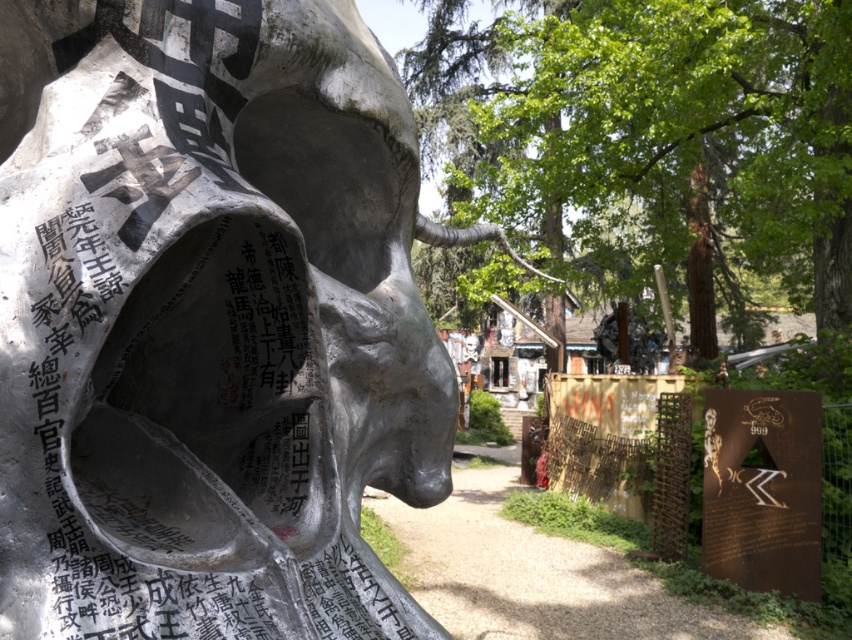
You are a visitor at the sculpture garden and notice the polished silver skull at center and the green leafy tree at center. Which one is located to the left when facing the sculpture?

The polished silver skull at center is positioned on the left side of green leafy tree at center, so it is located to the left when facing the sculpture.

You are a visitor at the sculpture garden and want to take a photo of the polished silver skull at center and the green leafy tree at center together in the frame. Given their sizes, which object should you place closer to the camera to ensure both fit in the photo?

Since the polished silver skull at center is smaller than the green leafy tree at center, you should place the camera closer to the polished silver skull at center to balance their sizes in the photo.

You are standing in front of the sculpture and want to take a photo of the polished silver skull at center. If your camera can focus on objects up to 30 inches away, will you need to step back to get a clear shot?

The polished silver skull at center is 33.15 inches away from the viewer. Since your camera can focus up to 30 inches, you need to step back to ensure it is within the focus range.